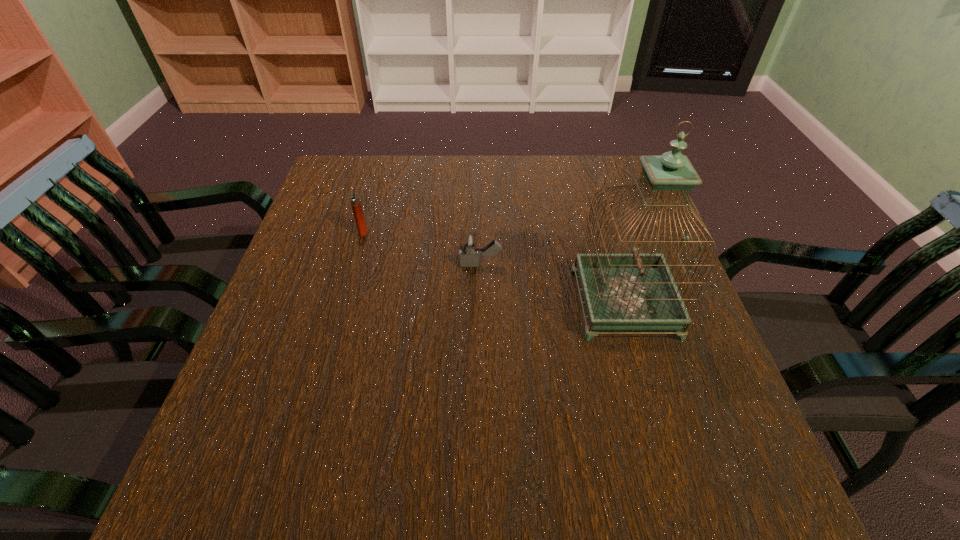
The width and height of the screenshot is (960, 540). I want to click on the tallest object, so click(635, 291).

Locate an element on the screen. This screenshot has width=960, height=540. birdcage is located at coordinates (635, 291).

Image resolution: width=960 pixels, height=540 pixels. Find the location of `the farthest object`. the farthest object is located at coordinates (355, 200).

Where is `the left igniter`? The height and width of the screenshot is (540, 960). the left igniter is located at coordinates (355, 200).

Find the location of `the second object from right to left`. the second object from right to left is located at coordinates (468, 257).

Where is `the right igniter`? The height and width of the screenshot is (540, 960). the right igniter is located at coordinates (468, 257).

Identify the location of vacant area situated at the door of the tallest object. Image resolution: width=960 pixels, height=540 pixels. (444, 303).

Where is `vacant space located at the door of the tallest object`? This screenshot has height=540, width=960. vacant space located at the door of the tallest object is located at coordinates (420, 303).

Find the location of a particular element. vacant space located 0.360m at the door of the tallest object is located at coordinates (412, 303).

I want to click on free space located 0.060m on the front of the leftmost object, so click(x=357, y=253).